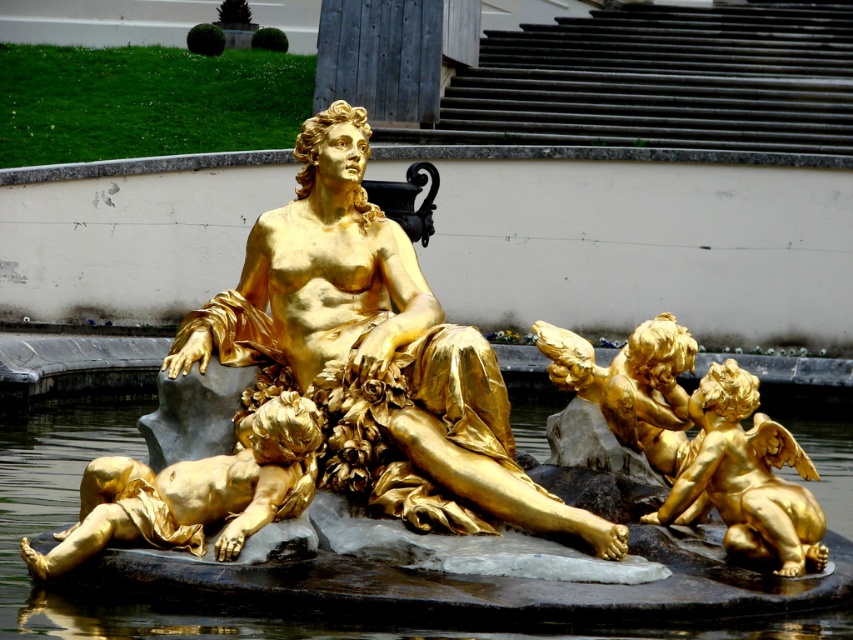
You are an art conservator assessing the statue and cherub. Which object is taller between the gold polished statue at center and the gold polished cherub at lower left?

The gold polished statue at center is taller than the gold polished cherub at lower left according to the description.

Based on the photo, you are standing at the point closest to the main statue in the fountain. Which of the two points, point [332,122] or point [270,636], is farther away from you?

Point [332,122] is behind point [270,636], so if you are standing at the point closest to the main statue, point [332,122] is farther away from you.